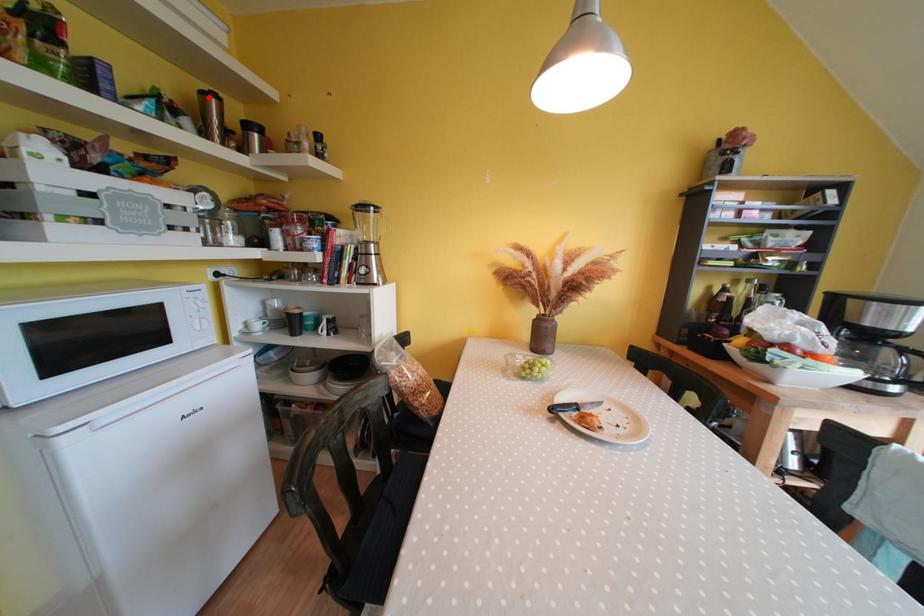
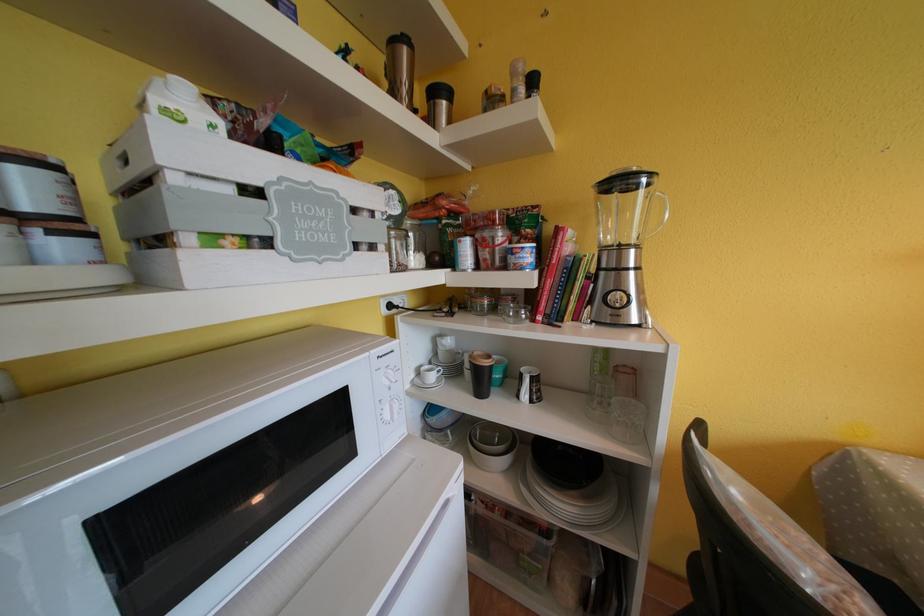
Find the pixel in the second image that matches the highlighted location in the first image.

(399, 46)